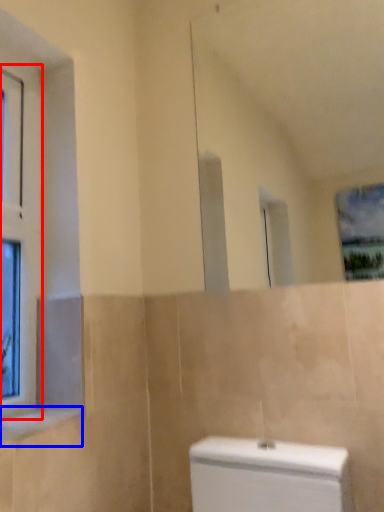
Question: Which point is closer to the camera, window (highlighted by a red box) or window sill (highlighted by a blue box)?

Choices:
 (A) window
 (B) window sill

Answer: (B)